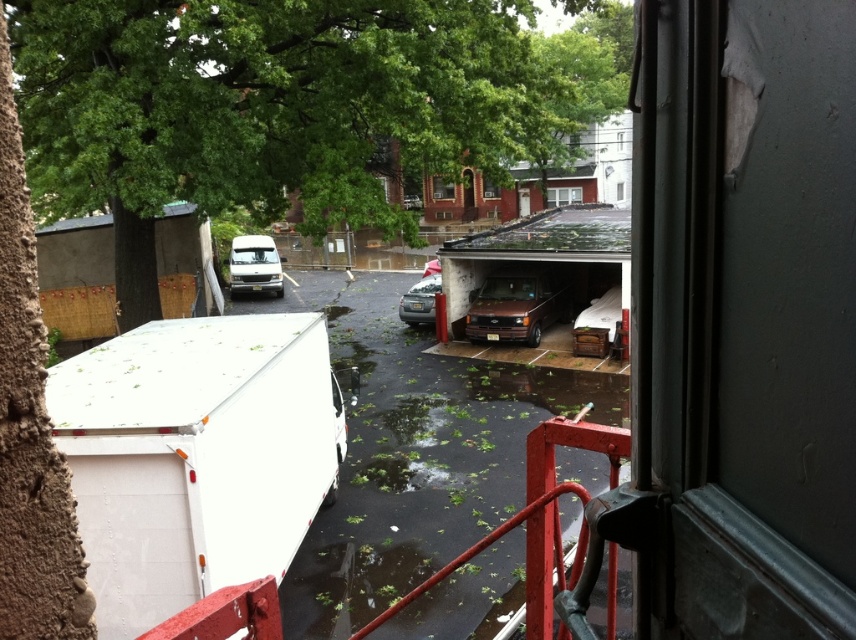
Question: Which object appears closest to the camera in this image?

Choices:
 (A) brown matte van at center
 (B) satin silver sedan at center
 (C) white matte van at center

Answer: (A)

Question: Is green leafy tree at upper left above satin silver sedan at center?

Choices:
 (A) no
 (B) yes

Answer: (B)

Question: In this image, where is green leafy tree at upper left located relative to white matte van at center?

Choices:
 (A) left
 (B) right

Answer: (B)

Question: Is the position of green leafy tree at upper left less distant than that of brown matte van at center?

Choices:
 (A) no
 (B) yes

Answer: (B)

Question: Which of the following is the closest to the observer?

Choices:
 (A) (518, 310)
 (B) (165, 152)
 (C) (407, 467)

Answer: (B)

Question: Which is farther from the green leafy water at center?

Choices:
 (A) white matte van at center
 (B) brown matte van at center
 (C) satin silver sedan at center

Answer: (A)